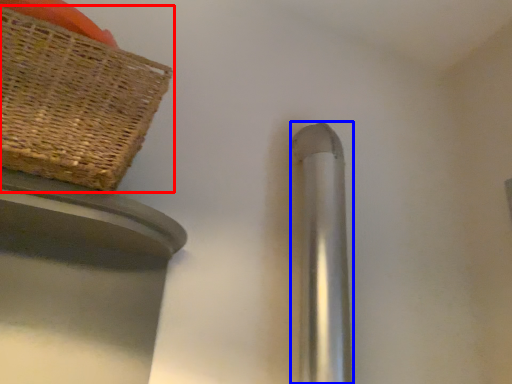
Question: Which object appears closest to the camera in this image, picnic basket (highlighted by a red box) or door handle (highlighted by a blue box)?

Choices:
 (A) picnic basket
 (B) door handle

Answer: (A)